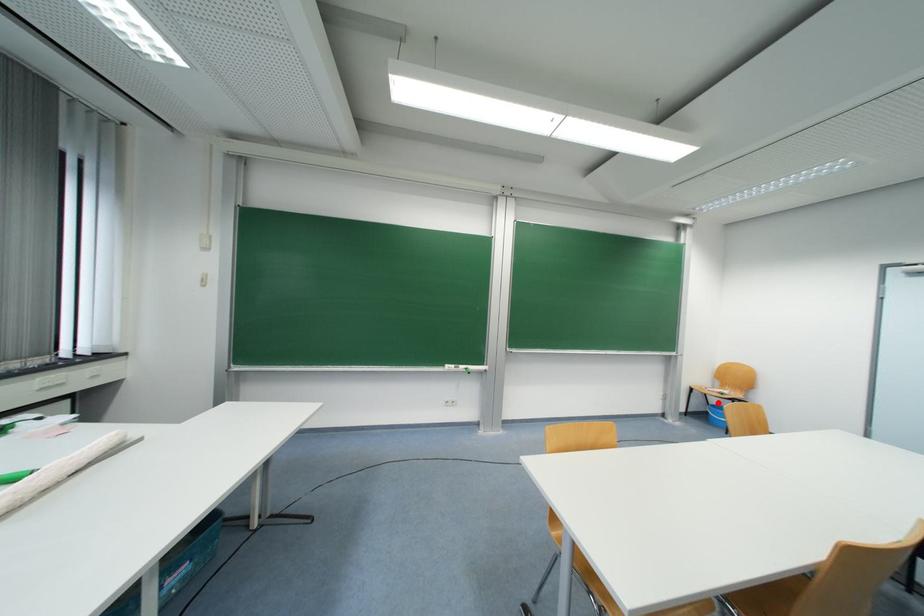
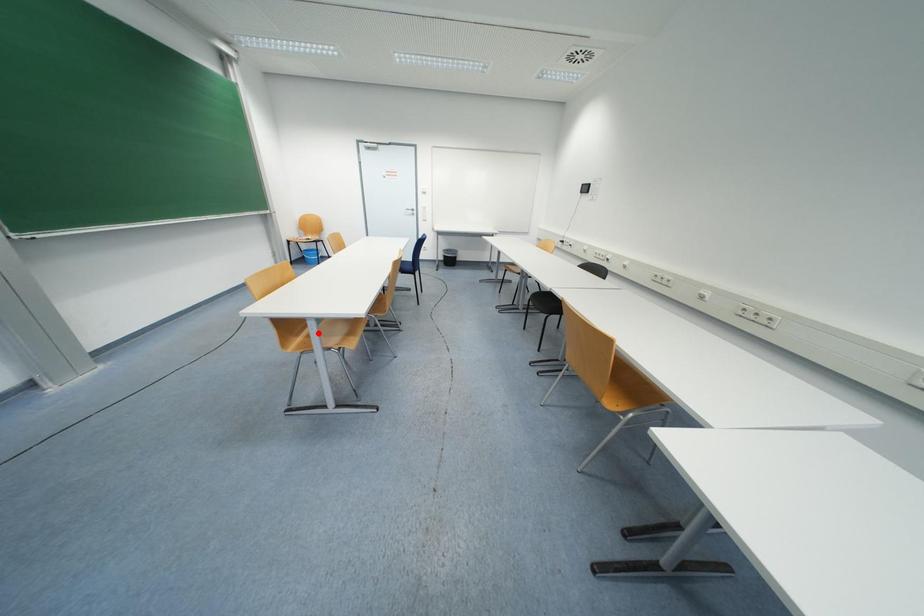
I am providing you with two images of the same scene from different viewpoints. A red point is marked on the first image and another point is marked on the second image. Are the points marked in image1 and image2 representing the same 3D position?

No